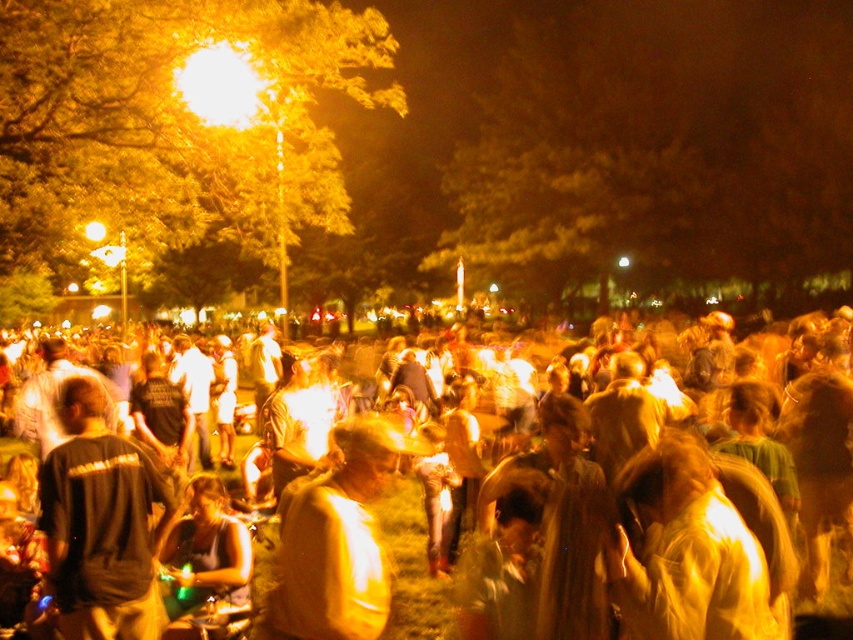
You are at the event and want to move from the location of point (59, 477) to the location of point (364, 512). Which direction should you move relative to the other point?

You should move forward towards point (364, 512) because point (59, 477) is behind it.

You are at an event and want to locate the shiny gold jacket at center among the yellowish fabric crowd at center. Given their sizes, which one would be harder to spot?

The shiny gold jacket at center would be harder to spot because the yellowish fabric crowd at center has a larger size, making the smaller shiny gold jacket at center less noticeable.